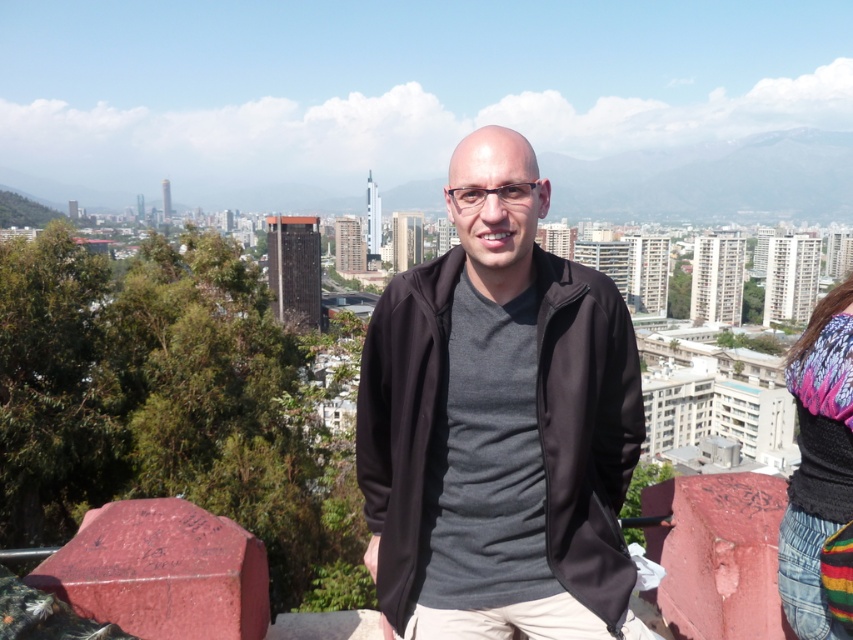
Locate an element on the screen. The height and width of the screenshot is (640, 853). black matte jacket at center is located at coordinates (498, 420).

Does black matte jacket at center have a larger size compared to knitted multicolor sweater at right?

Correct, black matte jacket at center is larger in size than knitted multicolor sweater at right.

The width and height of the screenshot is (853, 640). What do you see at coordinates (498, 420) in the screenshot?
I see `black matte jacket at center` at bounding box center [498, 420].

Image resolution: width=853 pixels, height=640 pixels. I want to click on black matte jacket at center, so click(x=498, y=420).